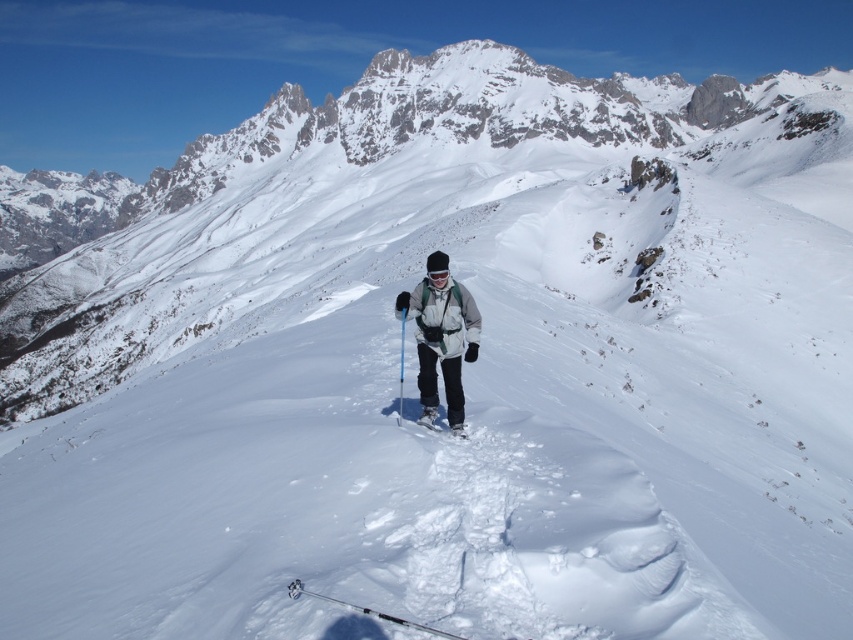
You are a photographer trying to capture the skier in the scene. You notice the white matte ski at center and the matte black ski pole at center. Which object should you focus on if you want to emphasize the smaller object in your photo?

The white matte ski at center is smaller than the matte black ski pole at center, so you should focus on the white matte ski at center to emphasize the smaller object in your photo.

You are a photographer trying to capture the skier and their equipment. You notice the black plastic ski pole at lower center and the white matte ski at center. Which object should you zoom in on if you want to focus on the larger one?

The black plastic ski pole at lower center is bigger than the white matte ski at center, so you should zoom in on the black plastic ski pole at lower center to focus on the larger one.